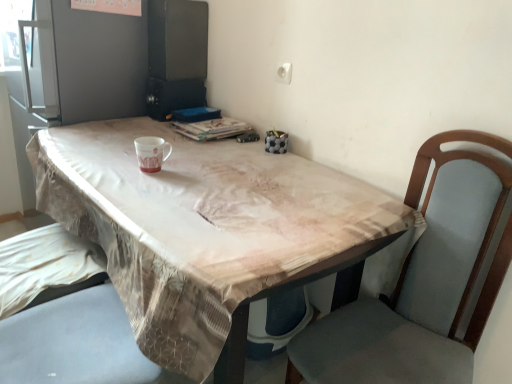
Question: Is the depth of brown fabric table at center less than that of matte ceramic mug at center?

Choices:
 (A) no
 (B) yes

Answer: (B)

Question: Can we say brown fabric table at center lies outside matte ceramic mug at center?

Choices:
 (A) yes
 (B) no

Answer: (A)

Question: Is brown fabric table at center at the right side of matte ceramic mug at center?

Choices:
 (A) no
 (B) yes

Answer: (B)

Question: Is brown fabric table at center at the left side of matte ceramic mug at center?

Choices:
 (A) yes
 (B) no

Answer: (B)

Question: Considering the relative sizes of brown fabric table at center and matte ceramic mug at center in the image provided, is brown fabric table at center thinner than matte ceramic mug at center?

Choices:
 (A) yes
 (B) no

Answer: (B)

Question: Are brown fabric table at center and matte ceramic mug at center far apart?

Choices:
 (A) no
 (B) yes

Answer: (A)

Question: Can you confirm if matte ceramic mug at center is thinner than brown fabric table at center?

Choices:
 (A) no
 (B) yes

Answer: (B)

Question: Is matte ceramic mug at center not near brown fabric table at center?

Choices:
 (A) no
 (B) yes

Answer: (A)

Question: From a real-world perspective, is matte ceramic mug at center located beneath brown fabric table at center?

Choices:
 (A) no
 (B) yes

Answer: (A)

Question: Considering the relative sizes of matte ceramic mug at center and brown fabric table at center in the image provided, is matte ceramic mug at center bigger than brown fabric table at center?

Choices:
 (A) no
 (B) yes

Answer: (A)

Question: From the image's perspective, is matte ceramic mug at center located beneath brown fabric table at center?

Choices:
 (A) yes
 (B) no

Answer: (B)

Question: Is matte ceramic mug at center outside brown fabric table at center?

Choices:
 (A) yes
 (B) no

Answer: (A)

Question: Considering the positions of point (172, 364) and point (159, 137), is point (172, 364) closer or farther from the camera than point (159, 137)?

Choices:
 (A) farther
 (B) closer

Answer: (B)